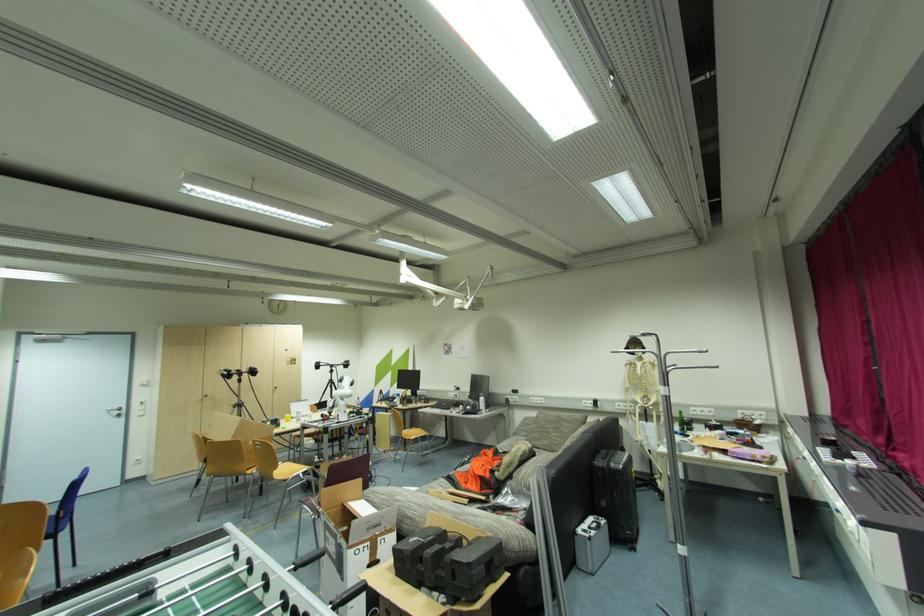
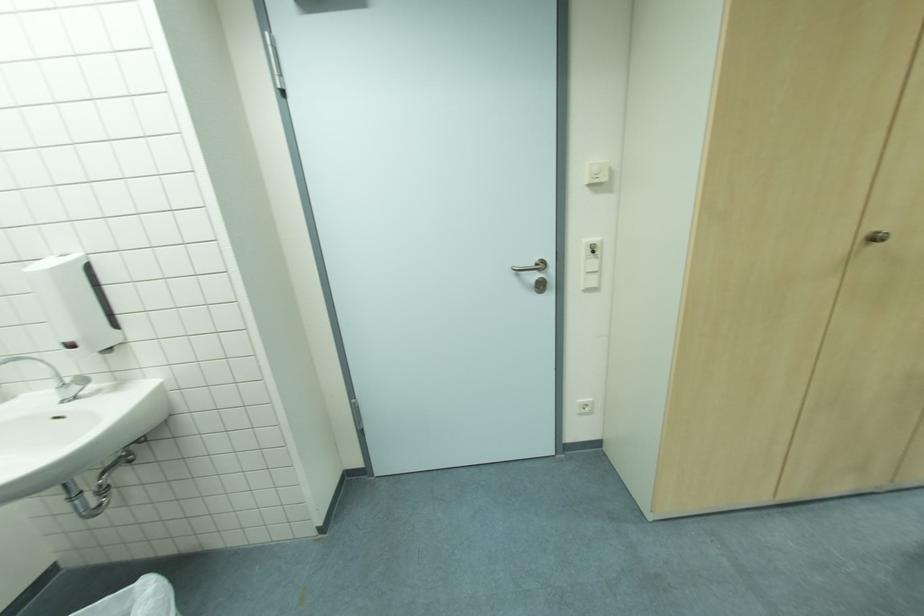
Where in the second image is the point corresponding to (x=150, y=384) from the first image?

(608, 179)